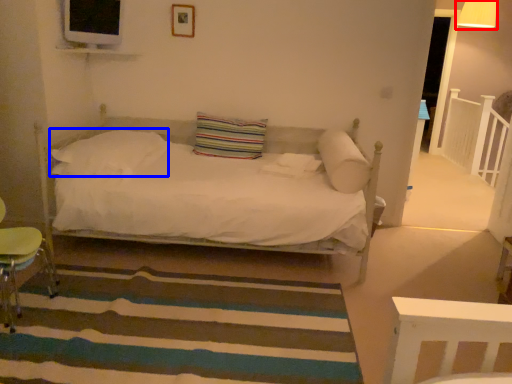
Question: Which point is further to the camera, lamp (highlighted by a red box) or pillow (highlighted by a blue box)?

Choices:
 (A) lamp
 (B) pillow

Answer: (A)